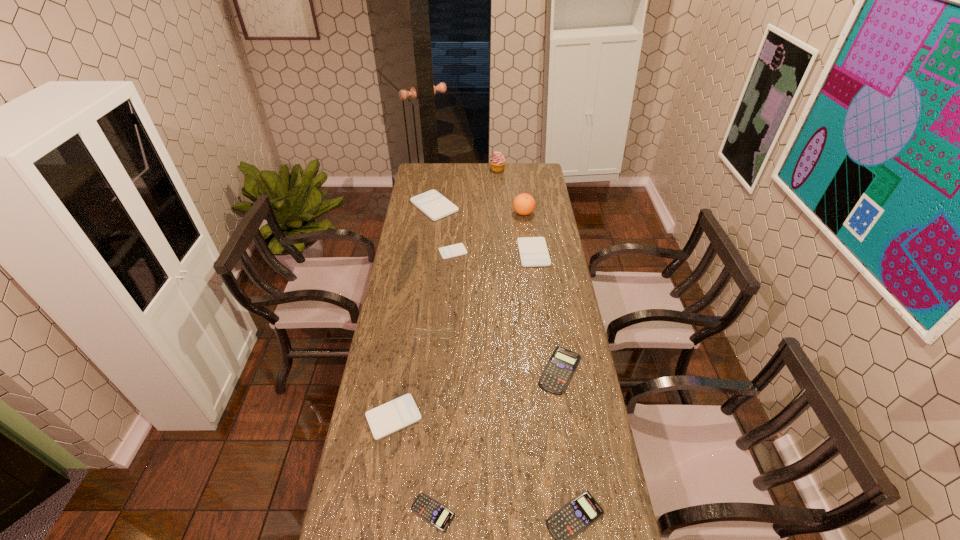
What are the coordinates of `the sixth object from left to right` in the screenshot? It's located at (497, 162).

Locate an element on the screen. The image size is (960, 540). the farthest object is located at coordinates (497, 162).

The height and width of the screenshot is (540, 960). Find the location of `orange`. orange is located at coordinates (524, 204).

Identify the location of beige spectacles. The image size is (960, 540). (446, 333).

Locate an element on the screen. the fifth nearest object is located at coordinates (446, 333).

This screenshot has height=540, width=960. Identify the location of the farthest white calculator. (433, 204).

I want to click on the seventh shortest object, so click(x=433, y=204).

Find the location of a particular element. This screenshot has width=960, height=540. the rightmost white calculator is located at coordinates (533, 251).

Where is `the third smallest white calculator`? This screenshot has width=960, height=540. the third smallest white calculator is located at coordinates (533, 251).

This screenshot has height=540, width=960. In order to click on the second smallest white calculator in this screenshot , I will do `click(392, 416)`.